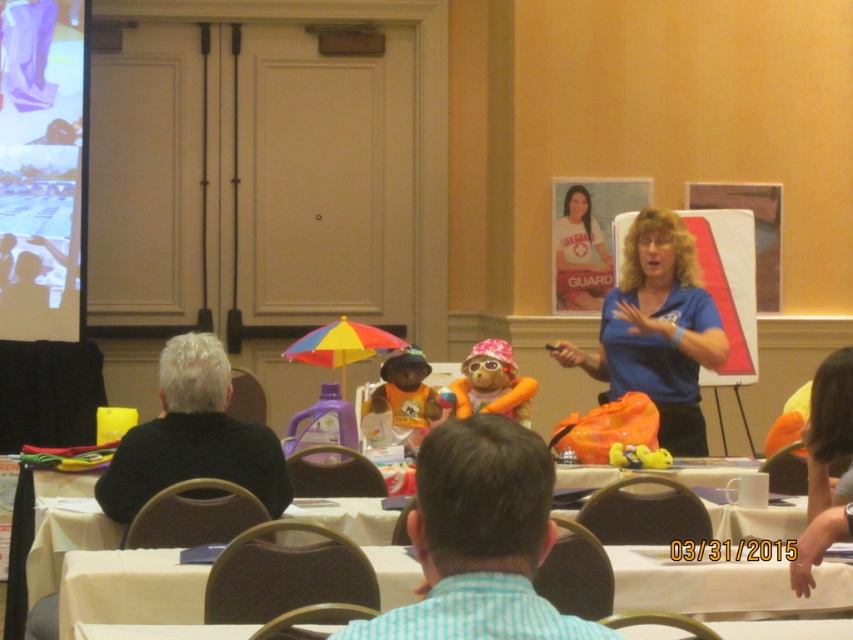
You are sitting at the back of the conference room and want to see the matte plastic screen at upper left and the black sweater at left. Which object is closer to you?

The matte plastic screen at upper left is closer to you because it is further to the viewer than the black sweater at left, meaning it appears nearer in the image.

From the picture: You are an event organizer who needs to place a name tag on a table between the orange plush bear at center and the rainbow fabric umbrella at center. The name tag requires 6 inches of space. Can you fit it there?

The distance between the orange plush bear at center and the rainbow fabric umbrella at center is 8.28 inches, so yes, the name tag requiring 6 inches of space can be placed between them since there is enough room.